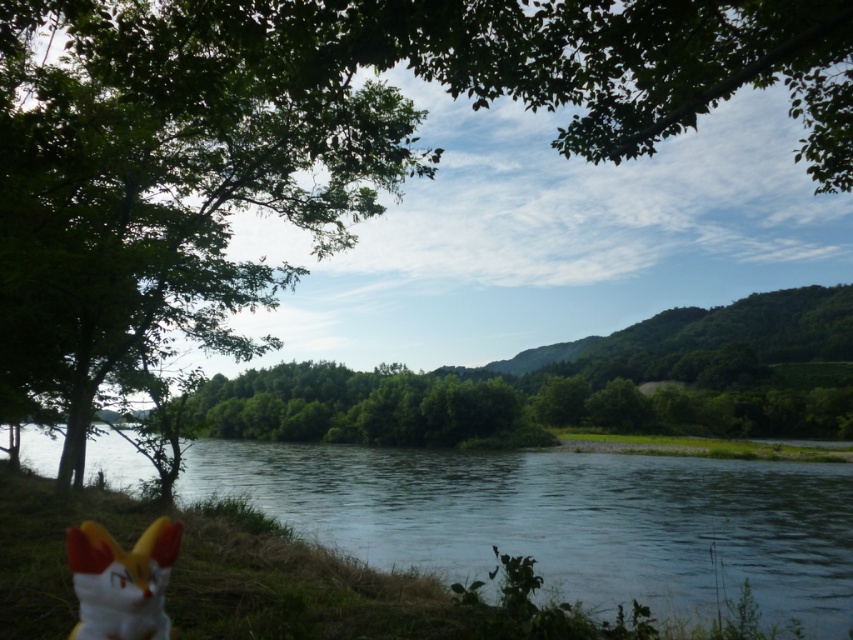
You are a hiker who wants to cross the river. You see the clear water at center and the white matte plush toy at lower left. Which object is taller? Use the scene description to help you decide.

The clear water at center is taller than the white matte plush toy at lower left according to the scene description.

You are a small boat that can only navigate through water. You want to reach the white matte plush toy at lower left from the clear water at center. Is the path between them wide enough for your boat?

The clear water at center might be wider than white matte plush toy at lower left, so the path between them is possibly wide enough for the boat to navigate safely.